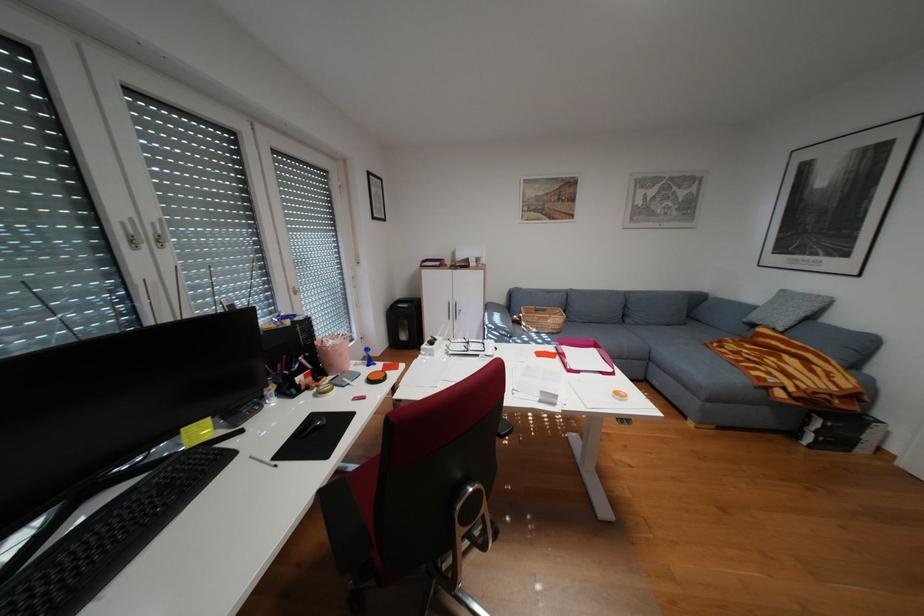
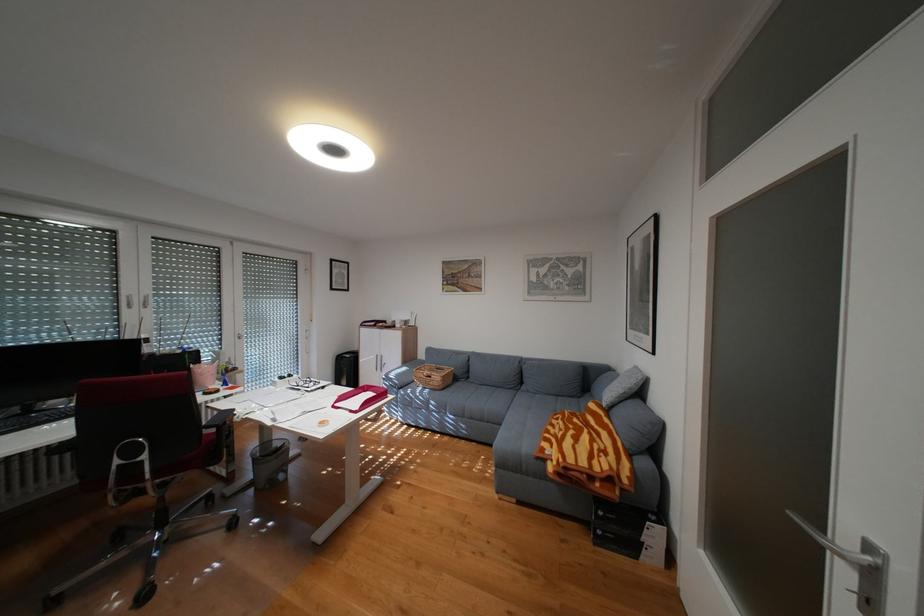
Locate, in the second image, the point that corresponds to (x=581, y=370) in the first image.

(346, 406)